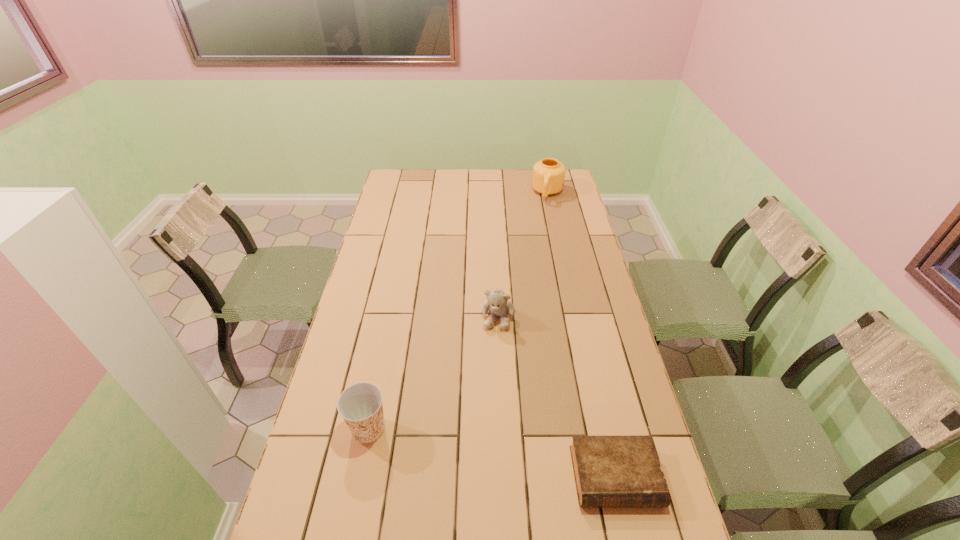
Where is `vacant space at the far edge of the desktop`? This screenshot has width=960, height=540. vacant space at the far edge of the desktop is located at coordinates (467, 180).

Identify the location of free space at the near edge. This screenshot has height=540, width=960. (443, 517).

In the image, there is a desktop. In order to click on vacant space at the left edge in this screenshot , I will do `click(403, 223)`.

This screenshot has width=960, height=540. What are the coordinates of `vacant space at the right edge of the desktop` in the screenshot? It's located at (592, 288).

In order to click on free spot between the farthest object and the second farthest object in this screenshot , I will do `click(523, 255)`.

Locate an element on the screen. vacant space in between the farthest object and the Dixie cup is located at coordinates (458, 311).

This screenshot has height=540, width=960. Find the location of `free space that is in between the shortest object and the third object from right to left`. free space that is in between the shortest object and the third object from right to left is located at coordinates (557, 397).

Identify the location of vacant region between the mug and the shortest object. (582, 335).

Where is `unoccupied area between the second object from left to right and the Dixie cup`? The image size is (960, 540). unoccupied area between the second object from left to right and the Dixie cup is located at coordinates (433, 373).

This screenshot has width=960, height=540. In order to click on vacant area between the shortest object and the teddy bear in this screenshot , I will do `click(557, 397)`.